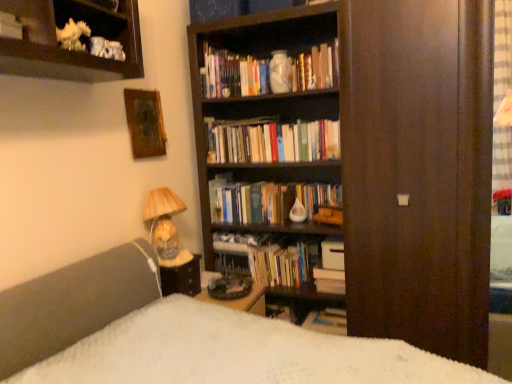
Question: In the image, is hardcover book at center, which ranks as the 1th book in bottom-to-top order, positioned in front of or behind hardcover books at upper center, which ranks as the 1th book in top-to-bottom order?

Choices:
 (A) behind
 (B) front

Answer: (B)

Question: Considering the positions of hardcover book at center, positioned as the 6th book in top-to-bottom order, and hardcover books at upper center, which ranks as the 1th book in top-to-bottom order, in the image, is hardcover book at center, positioned as the 6th book in top-to-bottom order, wider or thinner than hardcover books at upper center, which ranks as the 1th book in top-to-bottom order,?

Choices:
 (A) wide
 (B) thin

Answer: (B)

Question: Estimate the real-world distances between objects in this image. Which object is closer to the hardcover books at center, the third book in the bottom-to-top sequence?

Choices:
 (A) white matte book at lower center, marked as the 3th book in a top-to-bottom arrangement
 (B) hardcover books at upper center, which ranks as the 1th book in top-to-bottom order
 (C) brown wood screen door at center
 (D) hardcover books at center, marked as the 2th book in a top-to-bottom arrangement
 (E) matte ceramic lamp at lower left

Answer: (A)

Question: Which is nearer to the porcelain vase at upper center?

Choices:
 (A) hardcover books at center, the third book in the bottom-to-top sequence
 (B) wooden picture frame at upper left
 (C) wooden desk at center
 (D) white matte book at lower center, marked as the fourth book in a bottom-to-top arrangement
 (E) brown wood screen door at center

Answer: (B)